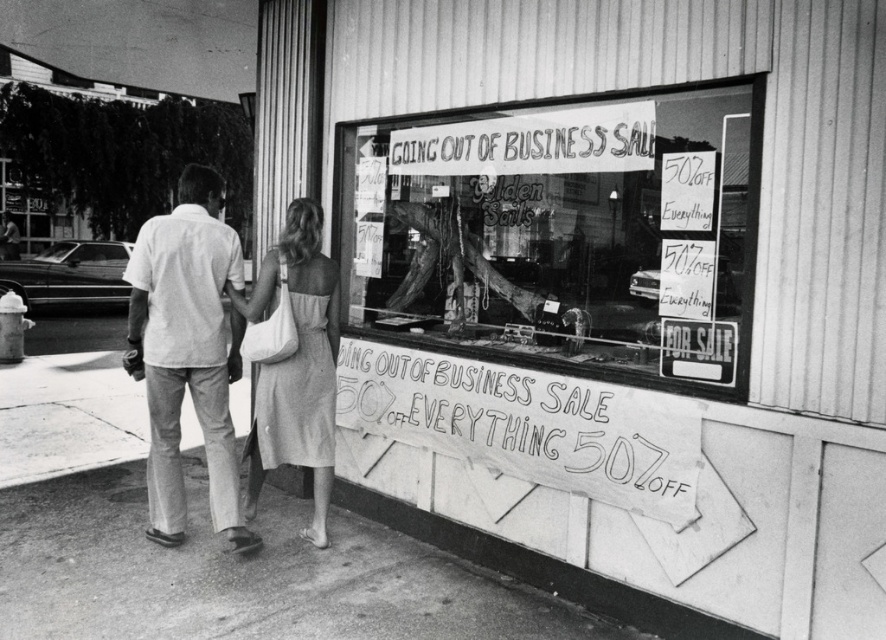
Which is more to the right, handwritten paper sign at lower center or light gray cotton dress at center?

Positioned to the right is handwritten paper sign at lower center.

Between handwritten paper sign at lower center and light gray cotton dress at center, which one appears on the left side from the viewer's perspective?

light gray cotton dress at center is more to the left.

Does point (605, 467) come farther from viewer compared to point (260, 460)?

No, it is not.

The height and width of the screenshot is (640, 886). I want to click on handwritten paper sign at lower center, so click(527, 424).

Which of these two, transparent glass window at center or white handwritten sign at upper center, stands shorter?

white handwritten sign at upper center is shorter.

Who is positioned more to the left, transparent glass window at center or white handwritten sign at upper center?

white handwritten sign at upper center

Locate an element on the screen. This screenshot has height=640, width=886. transparent glass window at center is located at coordinates (565, 236).

I want to click on transparent glass window at center, so click(565, 236).

Describe the element at coordinates (565, 236) in the screenshot. I see `transparent glass window at center` at that location.

Which is behind, point (743, 168) or point (262, 474)?

Point (262, 474)

Which is behind, point (614, 125) or point (298, 323)?

The point (298, 323) is more distant.

The image size is (886, 640). Identify the location of transparent glass window at center. (565, 236).